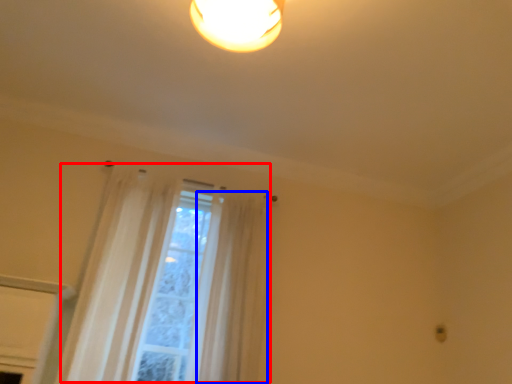
Question: Which of the following is the closest to the observer, curtain (highlighted by a red box) or curtain (highlighted by a blue box)?

Choices:
 (A) curtain
 (B) curtain

Answer: (A)